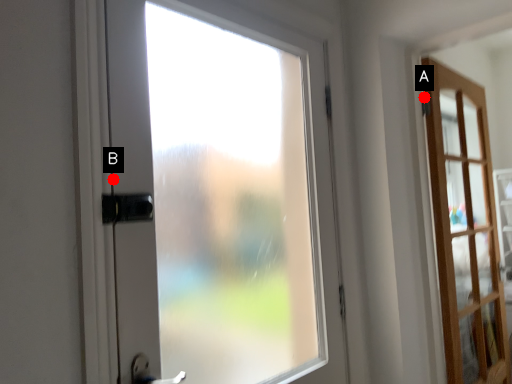
Question: Two points are circled on the image, labeled by A and B beside each circle. Which point is closer to the camera?

Choices:
 (A) A is closer
 (B) B is closer

Answer: (B)